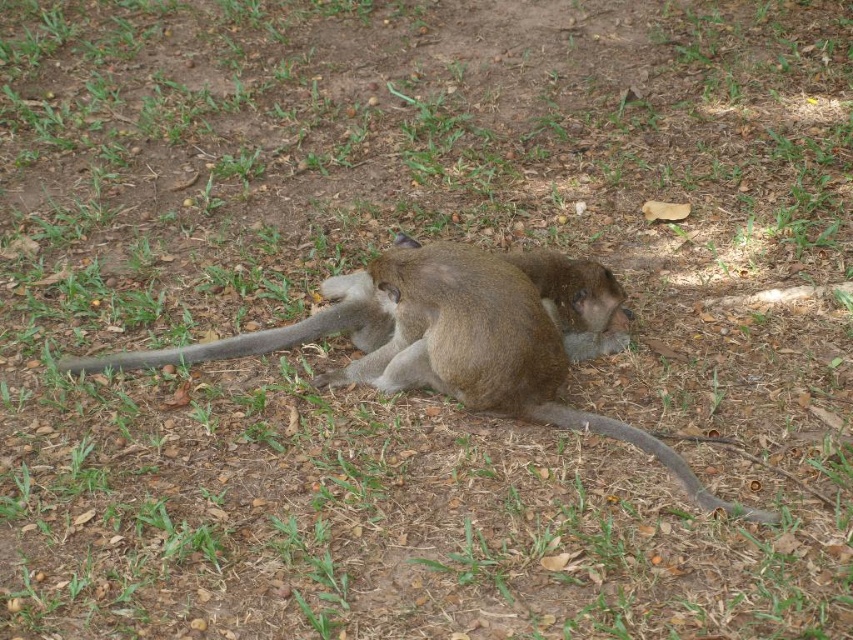
Consider the image. Which of these two, gray matte tail at center or brown fur tail at lower center, stands taller?

gray matte tail at center

You are a GUI agent. You are given a task and a screenshot of the screen. Output one action in this format:
    pyautogui.click(x=<x>, y=<y>)
    Task: Click on the gray matte tail at center
    
    Given the screenshot: What is the action you would take?
    (271, 332)

Locate an element on the screen. The image size is (853, 640). gray matte tail at center is located at coordinates (271, 332).

Is brown furry monkey at center thinner than brown fur tail at lower center?

Incorrect, brown furry monkey at center's width is not less than brown fur tail at lower center's.

Can you confirm if brown furry monkey at center is positioned below brown fur tail at lower center?

No.

The image size is (853, 640). I want to click on brown furry monkey at center, so click(x=457, y=337).

Identify the location of brown furry monkey at center. The width and height of the screenshot is (853, 640). (457, 337).

Does point (538, 269) lie in front of point (65, 369)?

Yes, it is in front of point (65, 369).

Is point (502, 380) positioned before point (276, 340)?

Yes.

Locate an element on the screen. brown furry monkey at center is located at coordinates (457, 337).